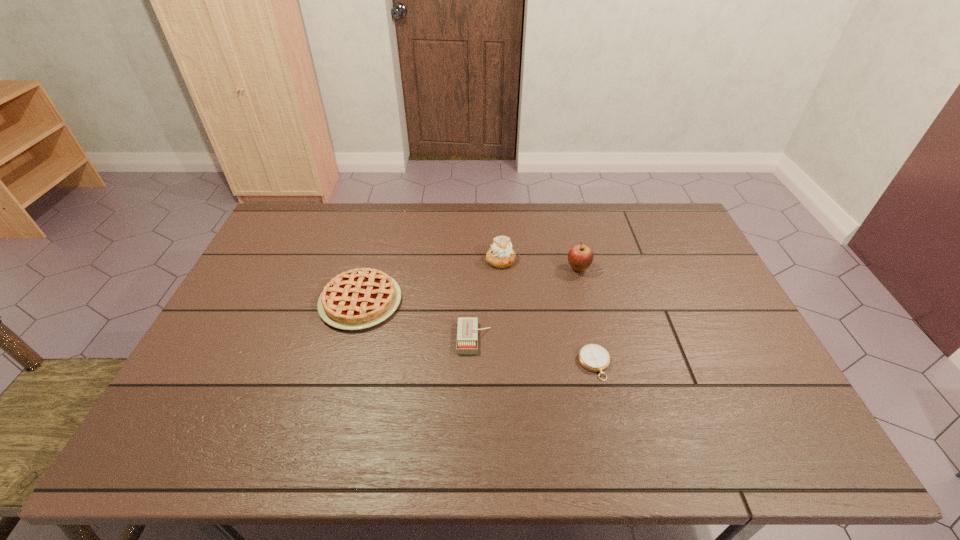
Locate an element on the screen. This screenshot has height=540, width=960. vacant space that satisfies the following two spatial constraints: 1. on the front side of the pastry; 2. on the left side of the shortest object is located at coordinates (506, 364).

The image size is (960, 540). Identify the location of free location that satisfies the following two spatial constraints: 1. on the front side of the pastry; 2. on the right side of the shortest object. (506, 364).